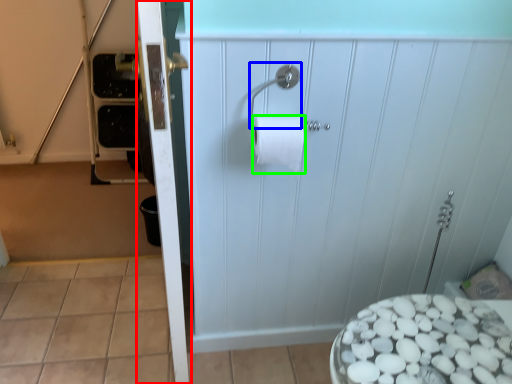
Question: Estimate the real-world distances between objects in this image. Which object is closer to screen door (highlighted by a red box), towel bar (highlighted by a blue box) or toilet paper (highlighted by a green box)?

Choices:
 (A) towel bar
 (B) toilet paper

Answer: (B)